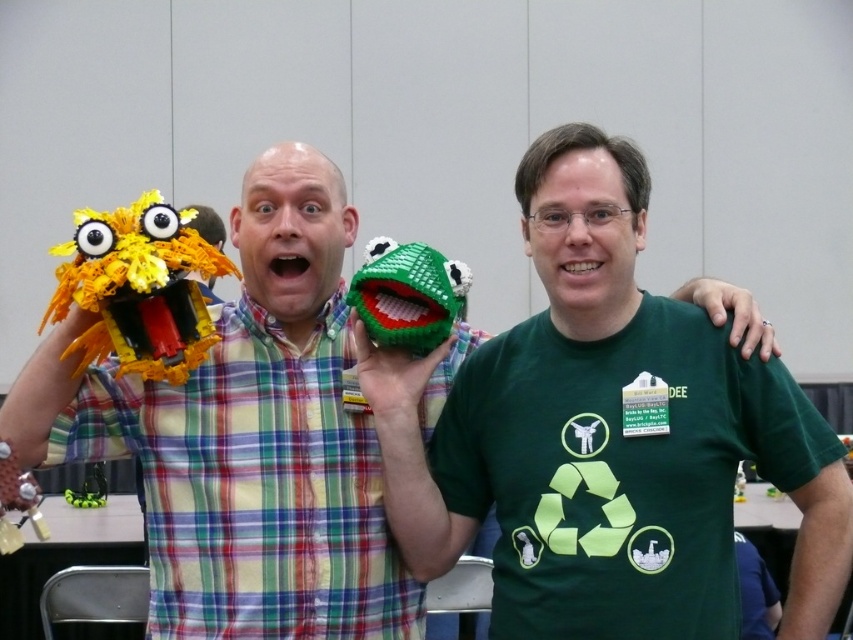
Can you confirm if green matte/soft toy at center is positioned to the left of yellow plastic bird at left?

No, green matte/soft toy at center is not to the left of yellow plastic bird at left.

Which is more to the right, green matte/soft toy at center or yellow plastic bird at left?

green matte/soft toy at center

This screenshot has width=853, height=640. What do you see at coordinates (605, 435) in the screenshot? I see `green matte/soft toy at center` at bounding box center [605, 435].

Identify the location of green matte/soft toy at center. (605, 435).

Which is behind, point (131, 276) or point (358, 291)?

The point (358, 291) is behind.

Which is in front, point (97, 285) or point (357, 275)?

Point (97, 285) is more forward.

Which is behind, point (155, 276) or point (416, 260)?

The point (416, 260) is more distant.

This screenshot has width=853, height=640. What are the coordinates of `yellow plastic bird at left` in the screenshot? It's located at (138, 289).

Consider the image. Can you confirm if plastic lego mask at upper center is positioned to the left of yellow plastic bird at left?

No, plastic lego mask at upper center is not to the left of yellow plastic bird at left.

At what (x,y) coordinates should I click in order to perform the action: click on plastic lego mask at upper center. Please return your answer as a coordinate pair (x, y). The width and height of the screenshot is (853, 640). Looking at the image, I should click on (244, 428).